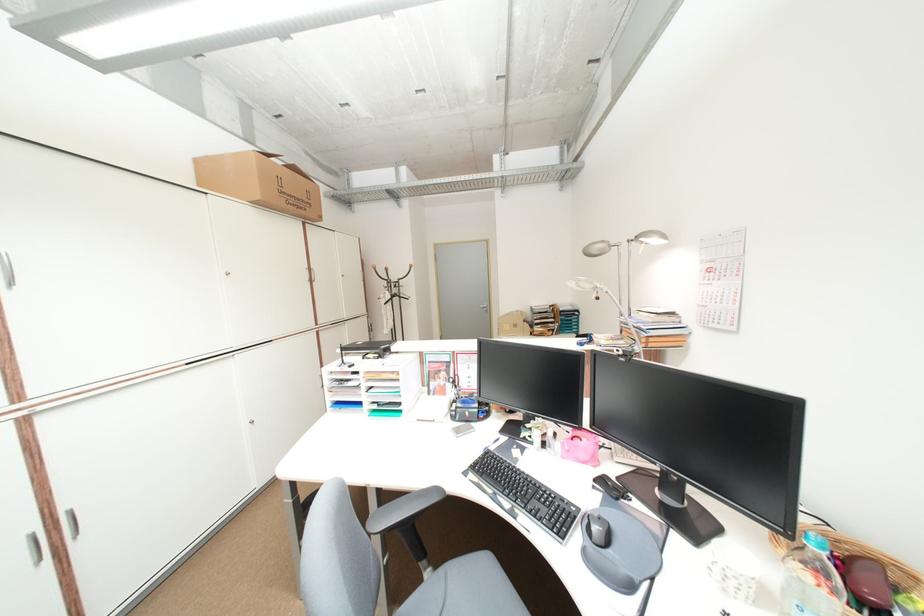
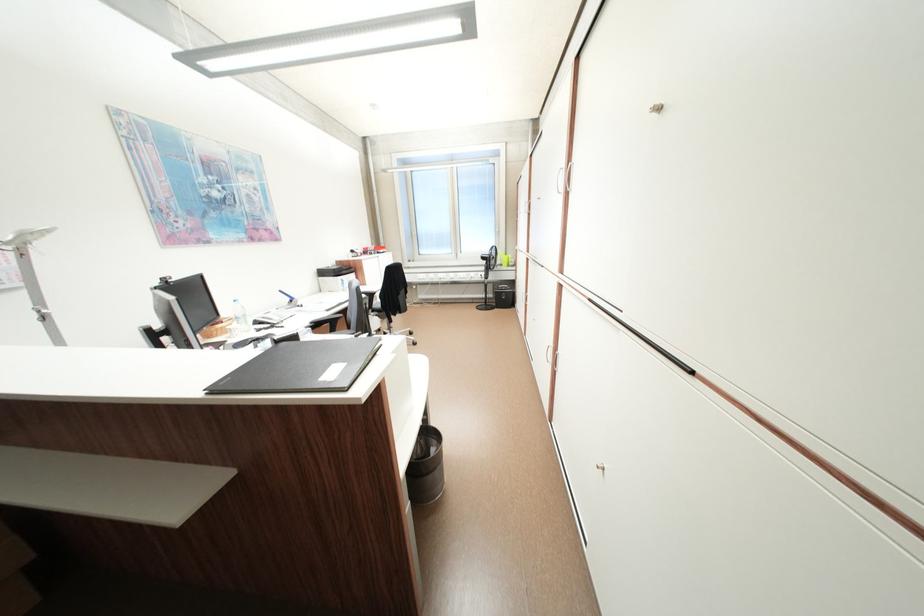
Question: I am providing you with two images of the same scene from different viewpoints. Please identify which objects are invisible in image2.

Choices:
 (A) black phone handset
 (B) cabinet lock
 (C) white cabinet handle
 (D) blue 'Iris' book

Answer: (A)